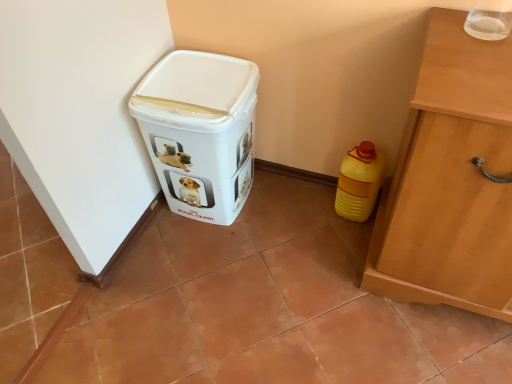
Identify the location of vacant region to the left of yellow plastic bottle at lower right. (306, 205).